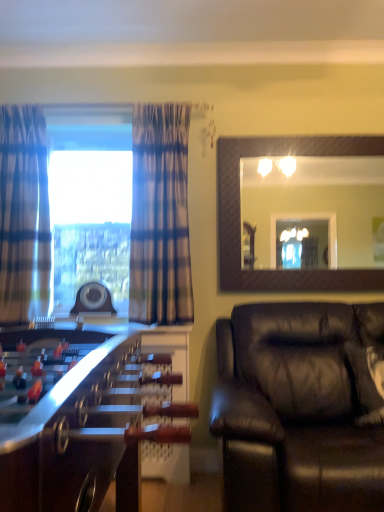
Question: Is matte brown mirror at upper right to the left of plaid fabric curtain at left, arranged as the second curtain when viewed from the right, from the viewer's perspective?

Choices:
 (A) no
 (B) yes

Answer: (A)

Question: Is plaid fabric curtain at left, acting as the 1th curtain starting from the left, located within matte brown mirror at upper right?

Choices:
 (A) no
 (B) yes

Answer: (A)

Question: Is matte brown mirror at upper right next to plaid fabric curtain at left, arranged as the second curtain when viewed from the right, and touching it?

Choices:
 (A) no
 (B) yes

Answer: (A)

Question: Can you confirm if matte brown mirror at upper right is smaller than plaid fabric curtain at left, acting as the 1th curtain starting from the left?

Choices:
 (A) yes
 (B) no

Answer: (A)

Question: Considering the relative sizes of matte brown mirror at upper right and plaid fabric curtain at left, arranged as the second curtain when viewed from the right, in the image provided, is matte brown mirror at upper right wider than plaid fabric curtain at left, arranged as the second curtain when viewed from the right,?

Choices:
 (A) no
 (B) yes

Answer: (A)

Question: In terms of width, does matte brown mirror at upper right look wider or thinner when compared to wooden foosball table at left?

Choices:
 (A) thin
 (B) wide

Answer: (A)

Question: Visually, is matte brown mirror at upper right positioned to the left or to the right of wooden foosball table at left?

Choices:
 (A) left
 (B) right

Answer: (B)

Question: Which is correct: matte brown mirror at upper right is inside wooden foosball table at left, or outside of it?

Choices:
 (A) inside
 (B) outside

Answer: (B)

Question: From the image's perspective, is matte brown mirror at upper right positioned above or below wooden foosball table at left?

Choices:
 (A) below
 (B) above

Answer: (B)

Question: Do you think matte brown mirror at upper right is within black leather couch at lower right, or outside of it?

Choices:
 (A) inside
 (B) outside

Answer: (B)

Question: From the image's perspective, relative to black leather couch at lower right, is matte brown mirror at upper right above or below?

Choices:
 (A) above
 (B) below

Answer: (A)

Question: Is point (223, 220) positioned closer to the camera than point (251, 352)?

Choices:
 (A) farther
 (B) closer

Answer: (A)

Question: Is matte brown mirror at upper right wider or thinner than black leather couch at lower right?

Choices:
 (A) wide
 (B) thin

Answer: (B)

Question: In terms of height, does plaid fabric curtain at left, arranged as the second curtain when viewed from the right, look taller or shorter compared to black leather couch at lower right?

Choices:
 (A) short
 (B) tall

Answer: (B)

Question: Is plaid fabric curtain at left, acting as the 1th curtain starting from the left, in front of or behind black leather couch at lower right in the image?

Choices:
 (A) front
 (B) behind

Answer: (B)